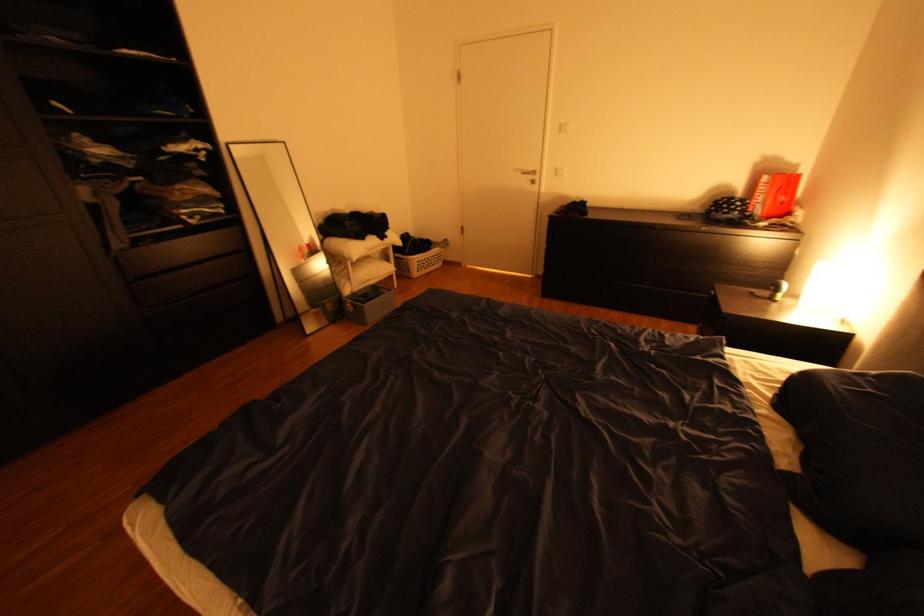
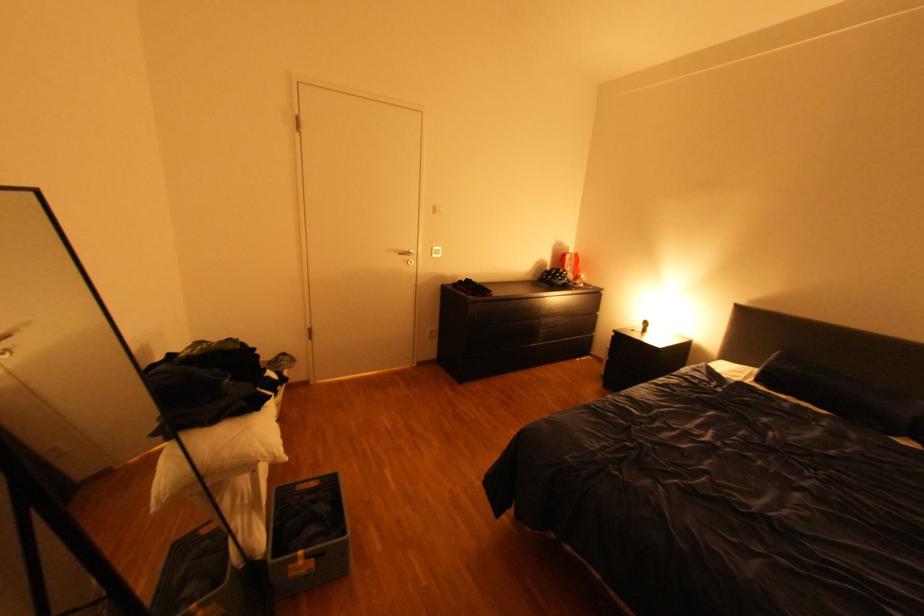
In the second image, find the point that corresponds to pixel 788 294 in the first image.

(659, 328)